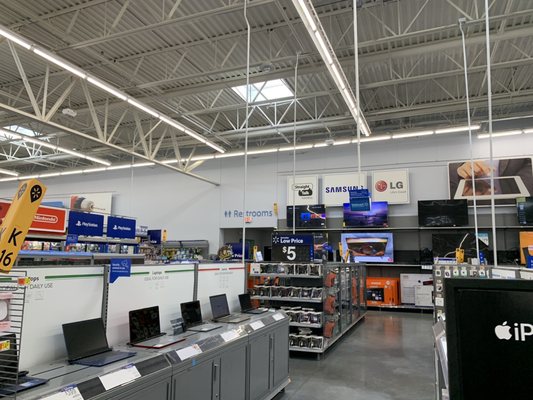
Where is `overhead fluorescent strip lights`? Image resolution: width=533 pixels, height=400 pixels. overhead fluorescent strip lights is located at coordinates (342, 86).